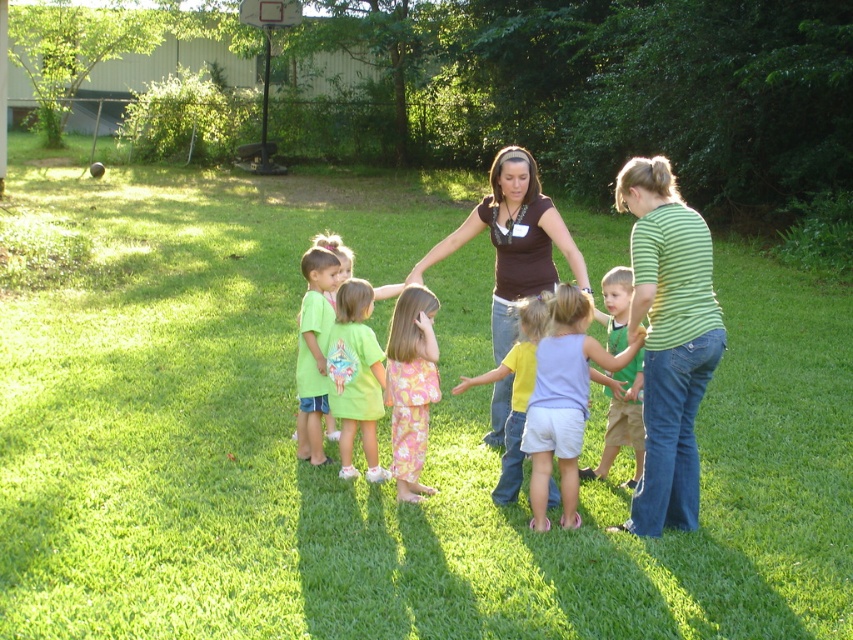
Question: Can you confirm if brown fabric shirt at center is positioned above lime green t-shirt at center?

Choices:
 (A) no
 (B) yes

Answer: (B)

Question: Which point appears farthest from the camera in this image?

Choices:
 (A) (310, 264)
 (B) (683, 340)

Answer: (A)

Question: Is floral cotton dress at center in front of yellow cotton shirt at center?

Choices:
 (A) yes
 (B) no

Answer: (B)

Question: Which of the following is the closest to the observer?

Choices:
 (A) brown fabric shirt at center
 (B) light purple cotton shirt at center

Answer: (B)

Question: Does green striped shirt at right have a smaller size compared to yellow cotton shirt at center?

Choices:
 (A) yes
 (B) no

Answer: (B)

Question: Which object is positioned farthest from the yellow cotton shirt at center?

Choices:
 (A) matte green t-shirt at center
 (B) brown fabric shirt at center
 (C) light purple cotton shorts at center

Answer: (A)